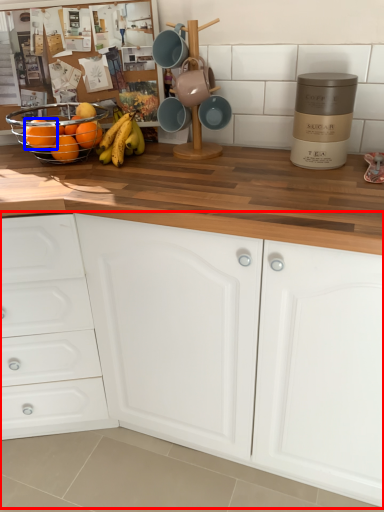
Question: Among these objects, which one is farthest to the camera, cabinetry (highlighted by a red box) or orange (highlighted by a blue box)?

Choices:
 (A) cabinetry
 (B) orange

Answer: (B)